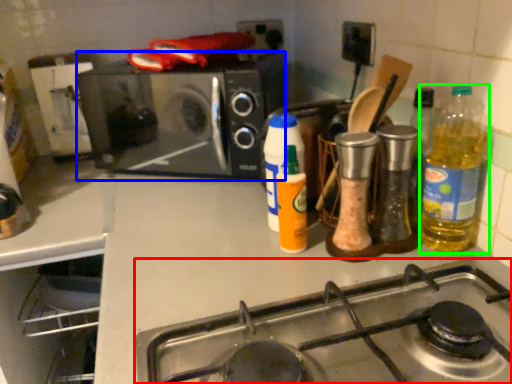
Question: Considering the real-world distances, which object is farthest from gas stove (highlighted by a red box)? microwave oven (highlighted by a blue box) or bottle (highlighted by a green box)?

Choices:
 (A) microwave oven
 (B) bottle

Answer: (A)